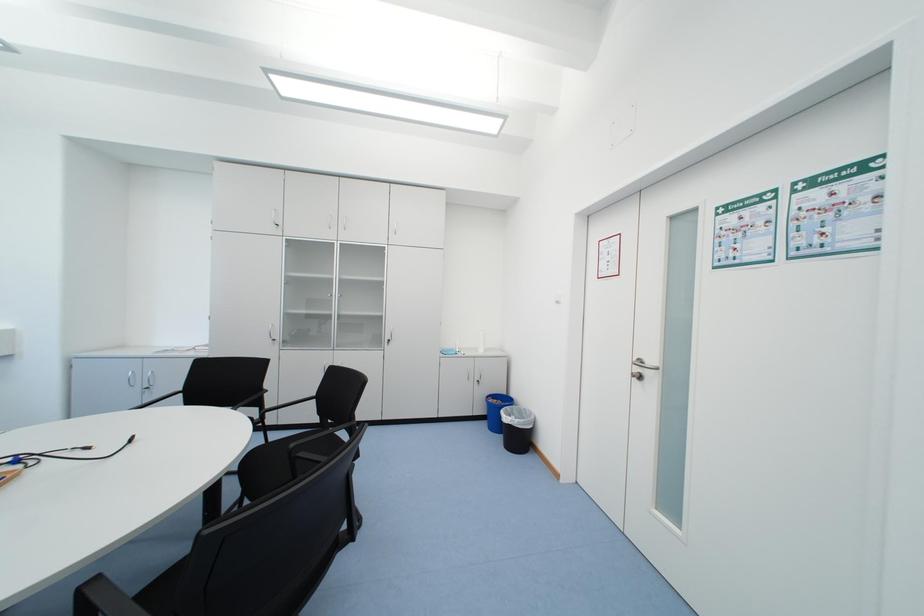
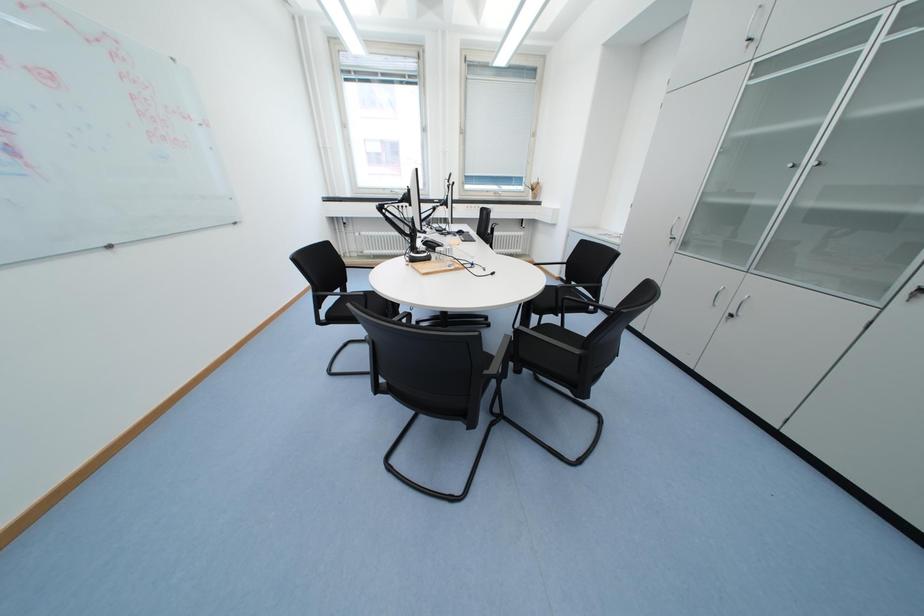
First-person continuous shooting, in which direction is the camera rotating?

The camera's rotation is toward left-down.